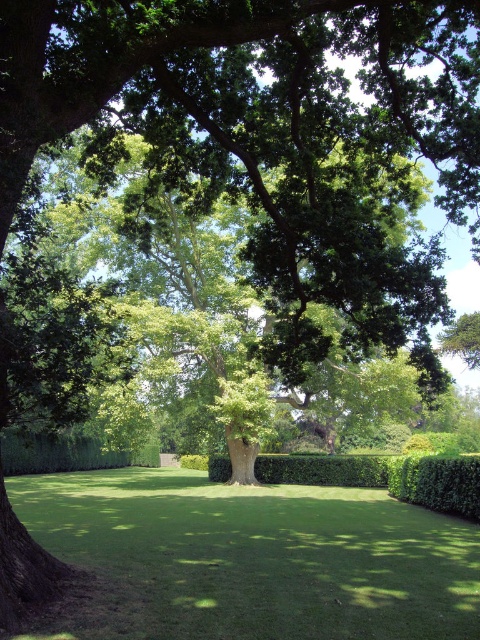
Question: Which of the following is the farthest from the observer?

Choices:
 (A) (163, 499)
 (B) (448, 497)
 (C) (52, 468)

Answer: (C)

Question: Which object appears closest to the camera in this image?

Choices:
 (A) green leafy hedge at lower right
 (B) green leafy hedge at lower center

Answer: (B)

Question: Is the position of green grass at center less distant than that of green leafy hedge at lower right?

Choices:
 (A) no
 (B) yes

Answer: (B)

Question: Is green grass at center smaller than green leafy hedge at lower right?

Choices:
 (A) yes
 (B) no

Answer: (B)

Question: Which point is farther to the camera?

Choices:
 (A) (420, 502)
 (B) (52, 456)

Answer: (B)

Question: Can you confirm if green leafy hedge at lower right is bigger than green leafy hedge at lower center?

Choices:
 (A) yes
 (B) no

Answer: (B)